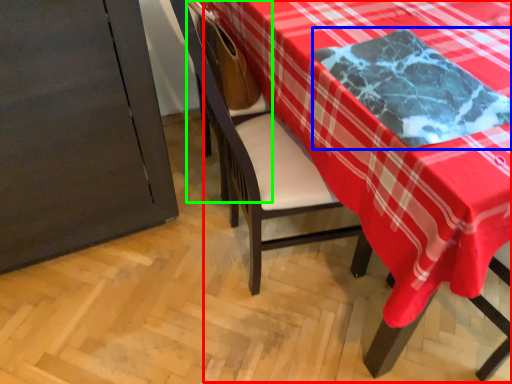
Question: Which object is positioned farthest from table (highlighted by a red box)? Select from cloth (highlighted by a blue box) and armchair (highlighted by a green box).

Choices:
 (A) cloth
 (B) armchair

Answer: (B)